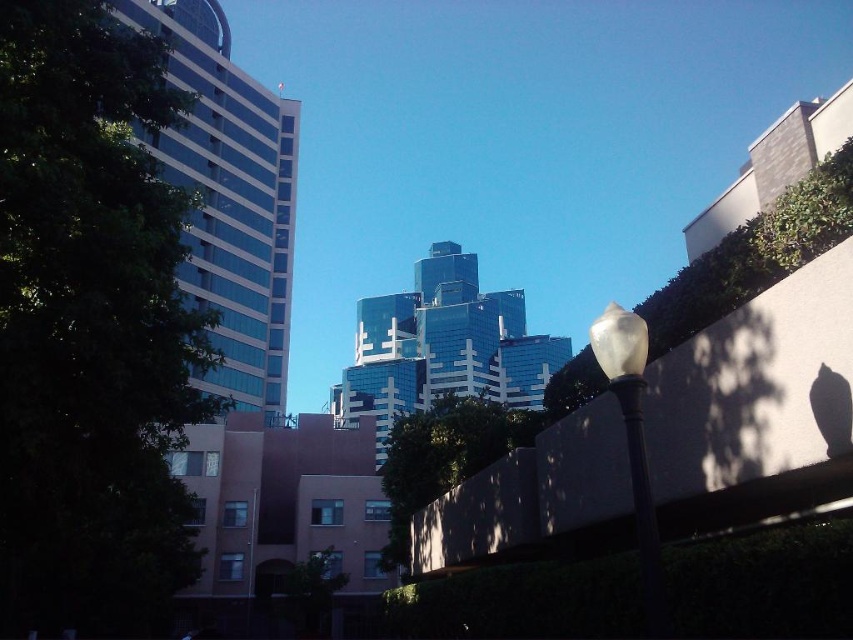
You are a city planner assessing the urban layout. You need to install a new streetlight that must be taller than the concrete wall at center but shorter than the white frosted glass lamp post at right. Is this possible?

The concrete wall at center is shorter than the white frosted glass lamp post at right. Therefore, it is possible to install a new streetlight with a height between the two, ensuring it is taller than the concrete wall at center but shorter than the white frosted glass lamp post at right.

You are standing at the point with coordinates point (656, 566) and want to look at the point with coordinates point (595, 460). Can you see it clearly from your current position?

Point (595, 460) is behind point (656, 566), so you cannot see it clearly from your current position.